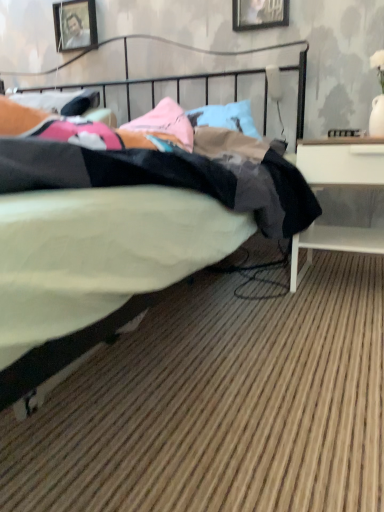
What do you see at coordinates (259, 14) in the screenshot? The height and width of the screenshot is (512, 384). I see `wooden picture frame at upper center, which is counted as the first picture frame, starting from the front` at bounding box center [259, 14].

Locate an element on the screen. This screenshot has width=384, height=512. black fabric bed at center is located at coordinates (94, 268).

In order to click on wooden picture frame at upper center, the 2th picture frame positioned from the left in this screenshot , I will do `click(259, 14)`.

Considering the points (303, 275) and (288, 6), which point is behind, point (303, 275) or point (288, 6)?

Positioned behind is point (288, 6).

Looking at this image, is wooden picture frame at upper center, marked as the 2th picture frame in a back-to-front arrangement, located within white matte desk at right?

No, wooden picture frame at upper center, marked as the 2th picture frame in a back-to-front arrangement, is not surrounded by white matte desk at right.

Where is `the 1st picture frame behind the white matte desk at right`? the 1st picture frame behind the white matte desk at right is located at coordinates (259, 14).

Consider the image. Looking at the image, does white matte desk at right seem bigger or smaller compared to wooden picture frame at upper center, which appears as the first picture frame when viewed from the right?

Clearly, white matte desk at right is larger in size than wooden picture frame at upper center, which appears as the first picture frame when viewed from the right.

The height and width of the screenshot is (512, 384). I want to click on desk lying below the wooden picture frame at upper left, arranged as the first picture frame when viewed from the left (from the image's perspective), so click(342, 162).

Between point (352, 237) and point (71, 23), which one is positioned behind?

Point (71, 23)

From the image's perspective, is white matte desk at right positioned above or below wooden picture frame at upper left, which is the 1th picture frame in back-to-front order?

Clearly, from the image's perspective, white matte desk at right is below wooden picture frame at upper left, which is the 1th picture frame in back-to-front order.

Is white matte desk at right turned away from wooden picture frame at upper left, which is counted as the second picture frame, starting from the right?

No, white matte desk at right is not facing the opposite direction of wooden picture frame at upper left, which is counted as the second picture frame, starting from the right.

In terms of width, does wooden picture frame at upper left, which is counted as the second picture frame, starting from the front, look wider or thinner when compared to wooden picture frame at upper center, which appears as the first picture frame when viewed from the right?

Clearly, wooden picture frame at upper left, which is counted as the second picture frame, starting from the front, has more width compared to wooden picture frame at upper center, which appears as the first picture frame when viewed from the right.

Consider the image. Is wooden picture frame at upper left, which is counted as the second picture frame, starting from the right, positioned with its back to wooden picture frame at upper center, marked as the 2th picture frame in a back-to-front arrangement?

That's not correct — wooden picture frame at upper left, which is counted as the second picture frame, starting from the right, is not looking away from wooden picture frame at upper center, marked as the 2th picture frame in a back-to-front arrangement.

From the image's perspective, is wooden picture frame at upper left, which is counted as the second picture frame, starting from the front, positioned above or below wooden picture frame at upper center, the 2th picture frame positioned from the left?

wooden picture frame at upper left, which is counted as the second picture frame, starting from the front, is above wooden picture frame at upper center, the 2th picture frame positioned from the left.

Is point (86, 34) less distant than point (255, 7)?

No, (86, 34) is further to viewer.

From a real-world perspective, is wooden picture frame at upper center, which appears as the first picture frame when viewed from the right, physically located above or below white matte desk at right?

In terms of real-world spatial position, wooden picture frame at upper center, which appears as the first picture frame when viewed from the right, is above white matte desk at right.

Between wooden picture frame at upper center, which is counted as the first picture frame, starting from the front, and white matte desk at right, which one has larger width?

With larger width is white matte desk at right.

Can you tell me how much wooden picture frame at upper center, which appears as the first picture frame when viewed from the right, and white matte desk at right differ in facing direction?

The angular difference between wooden picture frame at upper center, which appears as the first picture frame when viewed from the right, and white matte desk at right is 0.854 degrees.

Which is less distant, (x=260, y=15) or (x=345, y=138)?

Point (x=260, y=15) appears to be farther away from the viewer than point (x=345, y=138).

Considering the relative positions of wooden picture frame at upper left, which is counted as the second picture frame, starting from the front, and white matte desk at right in the image provided, is wooden picture frame at upper left, which is counted as the second picture frame, starting from the front, to the right of white matte desk at right from the viewer's perspective?

Incorrect, wooden picture frame at upper left, which is counted as the second picture frame, starting from the front, is not on the right side of white matte desk at right.

Does wooden picture frame at upper left, which is counted as the second picture frame, starting from the right, have a smaller size compared to white matte desk at right?

Yes, wooden picture frame at upper left, which is counted as the second picture frame, starting from the right, is smaller than white matte desk at right.

Can we say wooden picture frame at upper left, which is counted as the second picture frame, starting from the front, lies outside white matte desk at right?

Yes, wooden picture frame at upper left, which is counted as the second picture frame, starting from the front, is not within white matte desk at right.

Is wooden picture frame at upper center, the 2th picture frame positioned from the left, oriented away from black fabric bed at center?

No, wooden picture frame at upper center, the 2th picture frame positioned from the left, is not facing the opposite direction of black fabric bed at center.

From the image's perspective, is wooden picture frame at upper center, the 2th picture frame positioned from the left, below black fabric bed at center?

No, from the image's perspective, wooden picture frame at upper center, the 2th picture frame positioned from the left, is not below black fabric bed at center.

The image size is (384, 512). In order to click on bed in front of the wooden picture frame at upper center, which appears as the first picture frame when viewed from the right in this screenshot , I will do `click(94, 268)`.

Is wooden picture frame at upper left, arranged as the first picture frame when viewed from the left, positioned behind black fabric bed at center?

Yes, it is.

How many degrees apart are the facing directions of wooden picture frame at upper left, which is counted as the second picture frame, starting from the right, and black fabric bed at center?

0.653 degrees.

From a real-world perspective, is wooden picture frame at upper left, which is counted as the second picture frame, starting from the front, on black fabric bed at center?

Yes.

Where is `desk in front of the wooden picture frame at upper center, marked as the 2th picture frame in a back-to-front arrangement`? The height and width of the screenshot is (512, 384). desk in front of the wooden picture frame at upper center, marked as the 2th picture frame in a back-to-front arrangement is located at coordinates (342, 162).

The height and width of the screenshot is (512, 384). In order to click on picture frame that is the 2nd one when counting upward from the white matte desk at right (from the image's perspective) in this screenshot , I will do `click(75, 24)`.

Considering their positions, is white matte desk at right positioned closer to wooden picture frame at upper left, which is counted as the second picture frame, starting from the right, than black fabric bed at center?

white matte desk at right is positioned closer to the anchor wooden picture frame at upper left, which is counted as the second picture frame, starting from the right.

Estimate the real-world distances between objects in this image. Which object is further from white matte desk at right, black fabric bed at center or wooden picture frame at upper left, arranged as the first picture frame when viewed from the left?

Among the two, wooden picture frame at upper left, arranged as the first picture frame when viewed from the left, is located further to white matte desk at right.

Estimate the real-world distances between objects in this image. Which object is further from wooden picture frame at upper center, marked as the 2th picture frame in a back-to-front arrangement, white matte desk at right or black fabric bed at center?

black fabric bed at center lies further to wooden picture frame at upper center, marked as the 2th picture frame in a back-to-front arrangement, than the other object.

From the image, which object appears to be farther from wooden picture frame at upper left, which is counted as the second picture frame, starting from the right, wooden picture frame at upper center, the 2th picture frame positioned from the left, or white matte desk at right?

Based on the image, white matte desk at right appears to be further to wooden picture frame at upper left, which is counted as the second picture frame, starting from the right.

From the image, which object appears to be farther from wooden picture frame at upper left, arranged as the first picture frame when viewed from the left, white matte desk at right or wooden picture frame at upper center, the 2th picture frame positioned from the left?

The object further to wooden picture frame at upper left, arranged as the first picture frame when viewed from the left, is white matte desk at right.

Based on their spatial positions, is wooden picture frame at upper left, arranged as the first picture frame when viewed from the left, or wooden picture frame at upper center, which appears as the first picture frame when viewed from the right, further from black fabric bed at center?

wooden picture frame at upper left, arranged as the first picture frame when viewed from the left, lies further to black fabric bed at center than the other object.

Which object lies further to the anchor point wooden picture frame at upper center, which is counted as the first picture frame, starting from the front, black fabric bed at center or white matte desk at right?

black fabric bed at center is further to wooden picture frame at upper center, which is counted as the first picture frame, starting from the front.

Looking at this image, which object lies further to the anchor point black fabric bed at center, white matte desk at right or wooden picture frame at upper left, which is counted as the second picture frame, starting from the right?

Based on the image, wooden picture frame at upper left, which is counted as the second picture frame, starting from the right, appears to be further to black fabric bed at center.

Identify the location of picture frame between black fabric bed at center and wooden picture frame at upper left, which is the 1th picture frame in back-to-front order, in the front-back direction. The width and height of the screenshot is (384, 512). (259, 14).

This screenshot has width=384, height=512. In order to click on picture frame between wooden picture frame at upper left, which is counted as the second picture frame, starting from the front, and white matte desk at right in this screenshot , I will do `click(259, 14)`.

Identify the location of desk between black fabric bed at center and wooden picture frame at upper center, which appears as the first picture frame when viewed from the right, along the z-axis. (342, 162).

You are a GUI agent. You are given a task and a screenshot of the screen. Output one action in this format:
    pyautogui.click(x=<x>, y=<y>)
    Task: Click on the desk between black fabric bed at center and wooden picture frame at upper left, which is counted as the second picture frame, starting from the right, from front to back
    This screenshot has width=384, height=512.
    Given the screenshot: What is the action you would take?
    pyautogui.click(x=342, y=162)